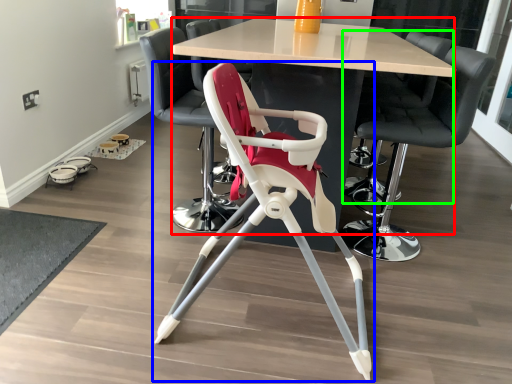
Question: Which object is the farthest from table (highlighted by a red box)? Choose among these: chair (highlighted by a blue box) or chair (highlighted by a green box).

Choices:
 (A) chair
 (B) chair

Answer: (A)